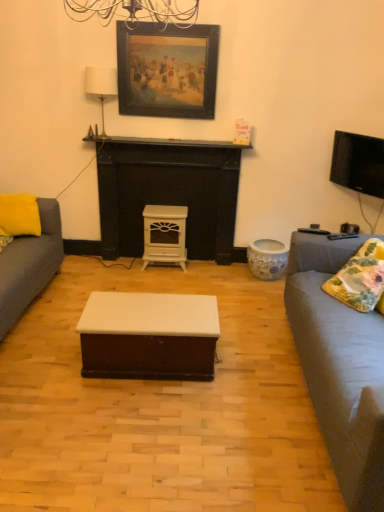
Where is `free location above wooden picture frame at upper center (from a real-world perspective)`? The width and height of the screenshot is (384, 512). free location above wooden picture frame at upper center (from a real-world perspective) is located at coordinates 172,16.